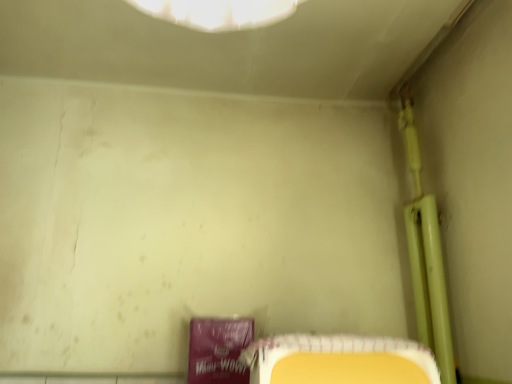
Question: Does yellow plastic tray at lower right contain green matte pipe at upper right?

Choices:
 (A) yes
 (B) no

Answer: (B)

Question: Is there a large distance between yellow plastic tray at lower right and green matte pipe at upper right?

Choices:
 (A) yes
 (B) no

Answer: (B)

Question: From a real-world perspective, is yellow plastic tray at lower right positioned over green matte pipe at upper right based on gravity?

Choices:
 (A) no
 (B) yes

Answer: (A)

Question: Is yellow plastic tray at lower right smaller than green matte pipe at upper right?

Choices:
 (A) no
 (B) yes

Answer: (B)

Question: Does yellow plastic tray at lower right touch green matte pipe at upper right?

Choices:
 (A) no
 (B) yes

Answer: (A)

Question: Is yellow plastic tray at lower right closer to the viewer compared to green matte pipe at upper right?

Choices:
 (A) yes
 (B) no

Answer: (A)

Question: From a real-world perspective, is green matte pipe at upper right physically below yellow plastic tray at lower right?

Choices:
 (A) yes
 (B) no

Answer: (B)

Question: Is the surface of green matte pipe at upper right in direct contact with yellow plastic tray at lower right?

Choices:
 (A) no
 (B) yes

Answer: (A)

Question: Is green matte pipe at upper right facing away from yellow plastic tray at lower right?

Choices:
 (A) yes
 (B) no

Answer: (B)

Question: Does green matte pipe at upper right contain yellow plastic tray at lower right?

Choices:
 (A) no
 (B) yes

Answer: (A)

Question: Considering the relative positions of green matte pipe at upper right and yellow plastic tray at lower right in the image provided, is green matte pipe at upper right to the left of yellow plastic tray at lower right from the viewer's perspective?

Choices:
 (A) no
 (B) yes

Answer: (A)

Question: Could you tell me if green matte pipe at upper right is facing yellow plastic tray at lower right?

Choices:
 (A) no
 (B) yes

Answer: (A)

Question: Is green matte pipe at upper right in front of or behind yellow plastic tray at lower right in the image?

Choices:
 (A) front
 (B) behind

Answer: (B)